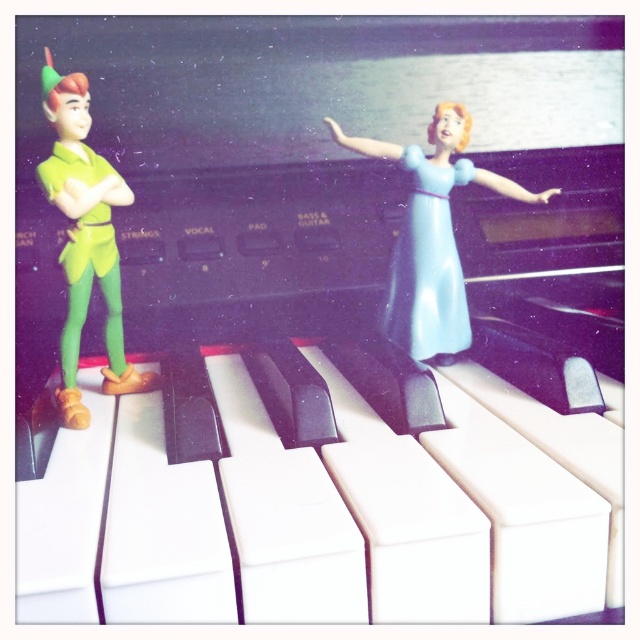
You are a child trying to arrange your toys on a piano keyboard. You have a light blue plastic figure at center and a light blue plastic dress at center. If you want to move the dress to the left of the figure, which toy should you move and in which direction?

You should move the light blue plastic dress at center to the right so that it ends up to the left of the light blue plastic figure at center. Alternatively, move the light blue plastic figure at center to the left to position it to the right of the dress.

You are organizing a display on a small shelf that can only accommodate items up to 10 cm in width. You have the light blue plastic figure at center and the green matte peter pan figurine at left. Which of these two items can fit on the shelf based on their widths?

The green matte peter pan figurine at left has a smaller width than the light blue plastic figure at center. Since the shelf can only hold items up to 10 cm, the green matte peter pan figurine at left is more likely to fit within the width constraint.